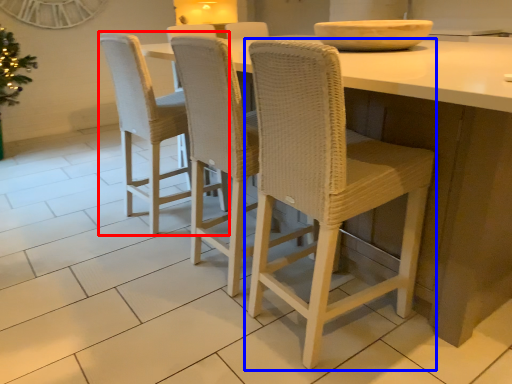
Question: Among these objects, which one is farthest to the camera, chair (highlighted by a red box) or chair (highlighted by a blue box)?

Choices:
 (A) chair
 (B) chair

Answer: (A)